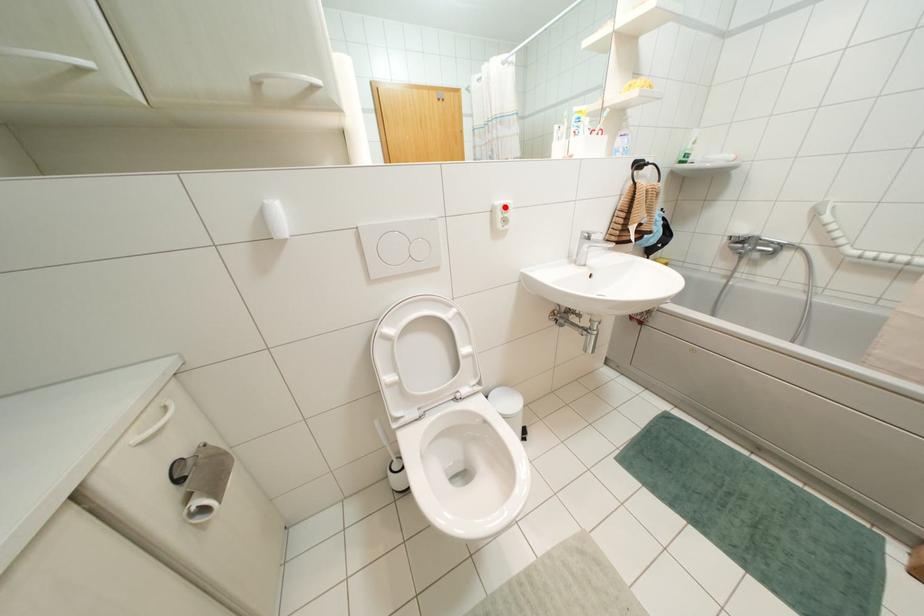
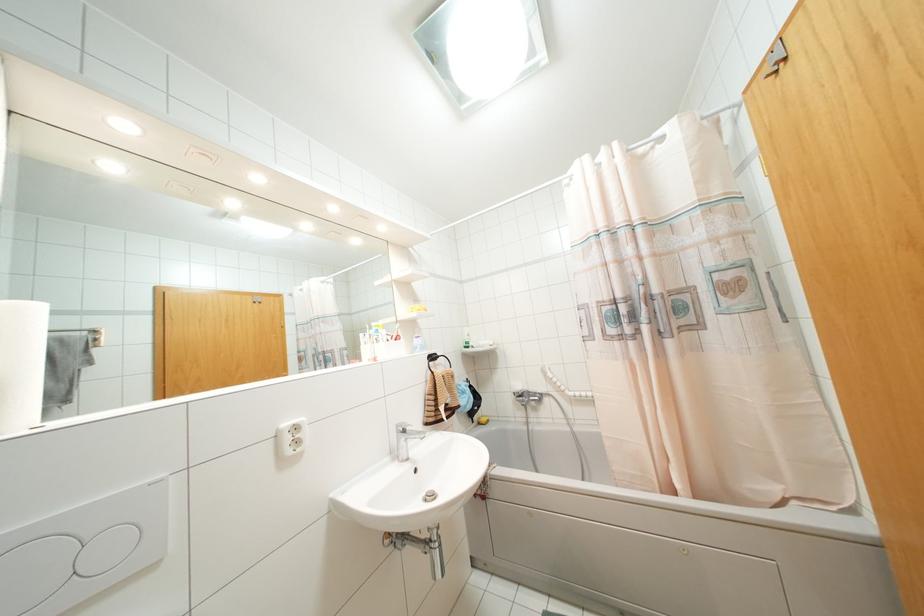
In the second image, find the point that corresponds to the highlighted location in the first image.

(296, 428)